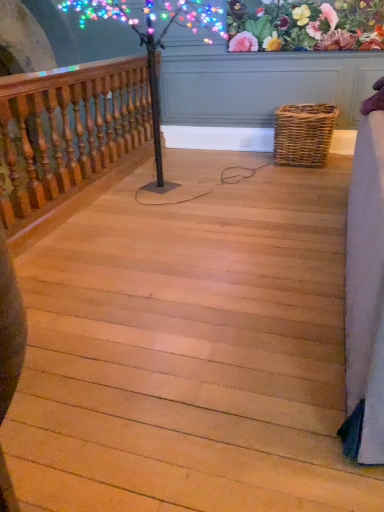
Where is `free point in front of woven brown picnic basket at lower right`? This screenshot has width=384, height=512. free point in front of woven brown picnic basket at lower right is located at coordinates (304, 175).